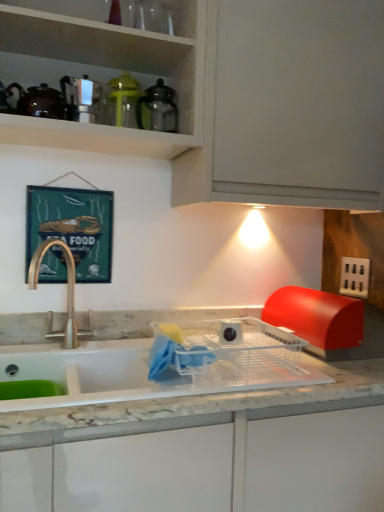
Question: Is black plastic electric outlet at right far away from satin nickel soap dispenser at upper left, the 1th appliance when ordered from left to right?

Choices:
 (A) yes
 (B) no

Answer: (A)

Question: Is satin nickel soap dispenser at upper left, the 1th appliance when ordered from left to right, at the back of black plastic electric outlet at right?

Choices:
 (A) yes
 (B) no

Answer: (B)

Question: Can you confirm if black plastic electric outlet at right is thinner than satin nickel soap dispenser at upper left, the 1th appliance when ordered from left to right?

Choices:
 (A) no
 (B) yes

Answer: (B)

Question: Is black plastic electric outlet at right shorter than satin nickel soap dispenser at upper left, the 3th appliance in the right-to-left sequence?

Choices:
 (A) no
 (B) yes

Answer: (A)

Question: Does black plastic electric outlet at right turn towards satin nickel soap dispenser at upper left, the 3th appliance in the right-to-left sequence?

Choices:
 (A) yes
 (B) no

Answer: (B)

Question: Does point (354, 288) appear closer or farther from the camera than point (91, 109)?

Choices:
 (A) farther
 (B) closer

Answer: (A)

Question: Would you say black plastic electric outlet at right is inside or outside satin nickel soap dispenser at upper left, the 3th appliance in the right-to-left sequence?

Choices:
 (A) inside
 (B) outside

Answer: (B)

Question: In the image, is black plastic electric outlet at right positioned in front of or behind satin nickel soap dispenser at upper left, the 3th appliance in the right-to-left sequence?

Choices:
 (A) front
 (B) behind

Answer: (B)

Question: From the image's perspective, is black plastic electric outlet at right above or below satin nickel soap dispenser at upper left, the 1th appliance when ordered from left to right?

Choices:
 (A) below
 (B) above

Answer: (A)

Question: Is point (46, 87) closer or farther from the camera than point (266, 351)?

Choices:
 (A) closer
 (B) farther

Answer: (B)

Question: In terms of height, does matte brown teapot at upper left look taller or shorter compared to white glossy sink at center?

Choices:
 (A) short
 (B) tall

Answer: (A)

Question: Considering the relative positions of matte brown teapot at upper left and white glossy sink at center in the image provided, is matte brown teapot at upper left to the left or to the right of white glossy sink at center?

Choices:
 (A) right
 (B) left

Answer: (B)

Question: From the image's perspective, is matte brown teapot at upper left located above or below white glossy sink at center?

Choices:
 (A) below
 (B) above

Answer: (B)

Question: From a real-world perspective, is satin nickel soap dispenser at upper left, the 1th appliance when ordered from left to right, physically located above or below white glossy sink at center?

Choices:
 (A) above
 (B) below

Answer: (A)

Question: Is satin nickel soap dispenser at upper left, the 3th appliance in the right-to-left sequence, taller or shorter than white glossy sink at center?

Choices:
 (A) tall
 (B) short

Answer: (B)